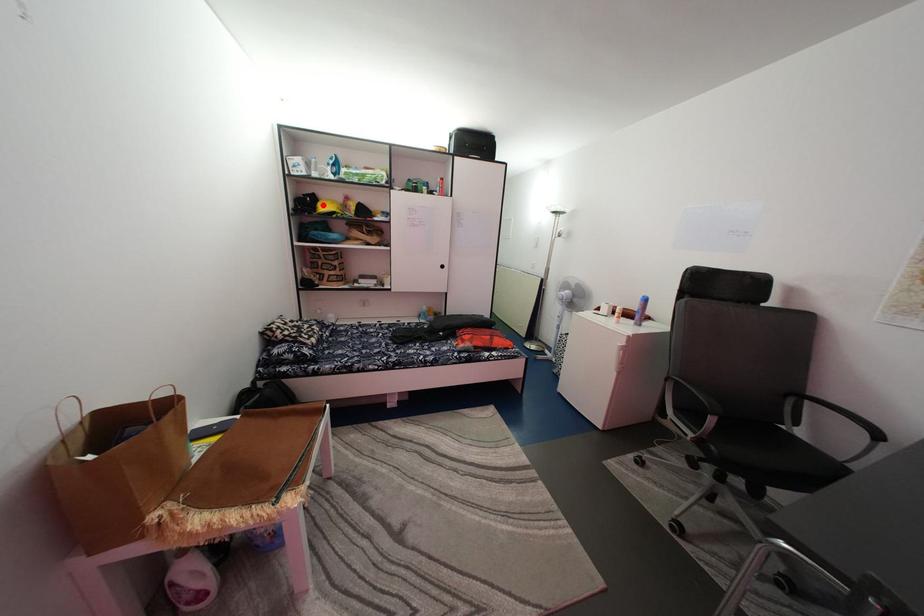
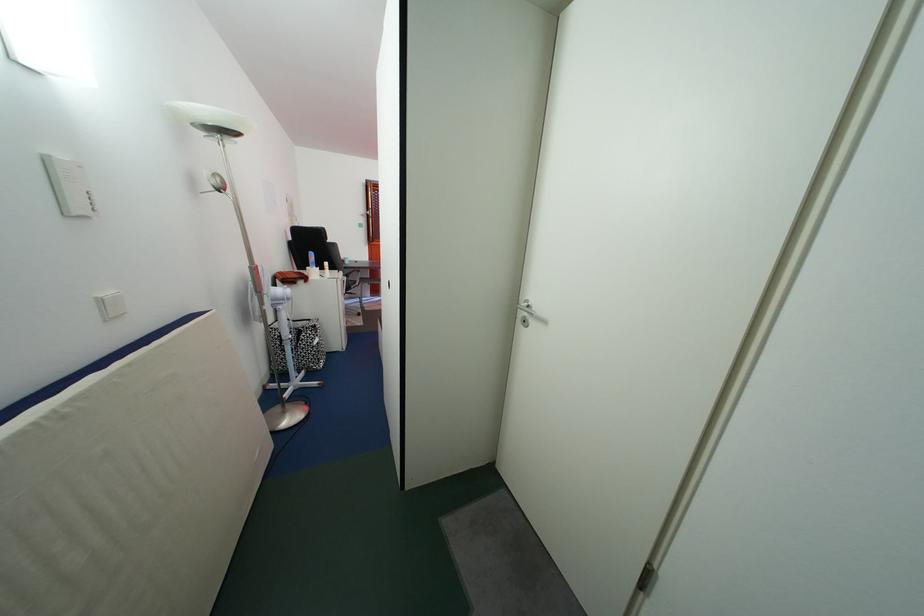
Question: I am providing you with two images of the same scene from different viewpoints. A red point is marked on the first image. At the location where the point appears in image 1, is it still visible in image 2?

Choices:
 (A) Yes
 (B) No

Answer: (B)